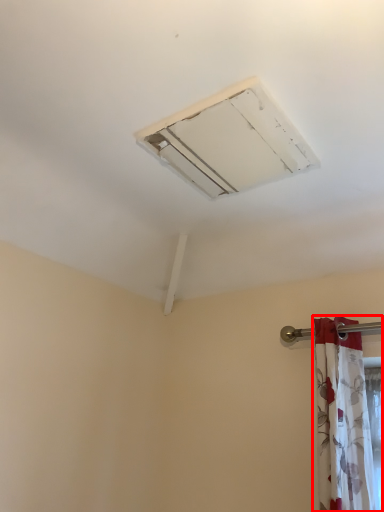
Question: From the image's perspective, what is the correct spatial positioning of curtain (annotated by the red box) in reference to air conditioning?

Choices:
 (A) below
 (B) above

Answer: (A)